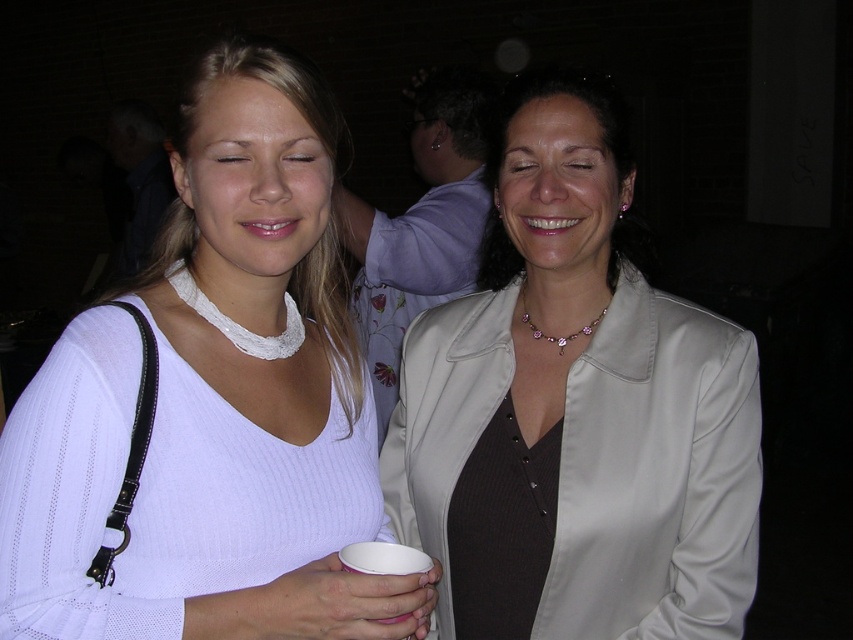
Question: Which of the following is the farthest from the observer?

Choices:
 (A) white ribbed sweater at center
 (B) satin beige blazer at center

Answer: (B)

Question: Which of the following is the closest to the observer?

Choices:
 (A) (503, 230)
 (B) (323, 109)

Answer: (B)

Question: From the image, what is the correct spatial relationship of white ribbed sweater at center in relation to satin beige blazer at center?

Choices:
 (A) above
 (B) below

Answer: (A)

Question: Is white ribbed sweater at center below satin beige blazer at center?

Choices:
 (A) no
 (B) yes

Answer: (A)

Question: Does white ribbed sweater at center appear over satin beige blazer at center?

Choices:
 (A) yes
 (B) no

Answer: (A)